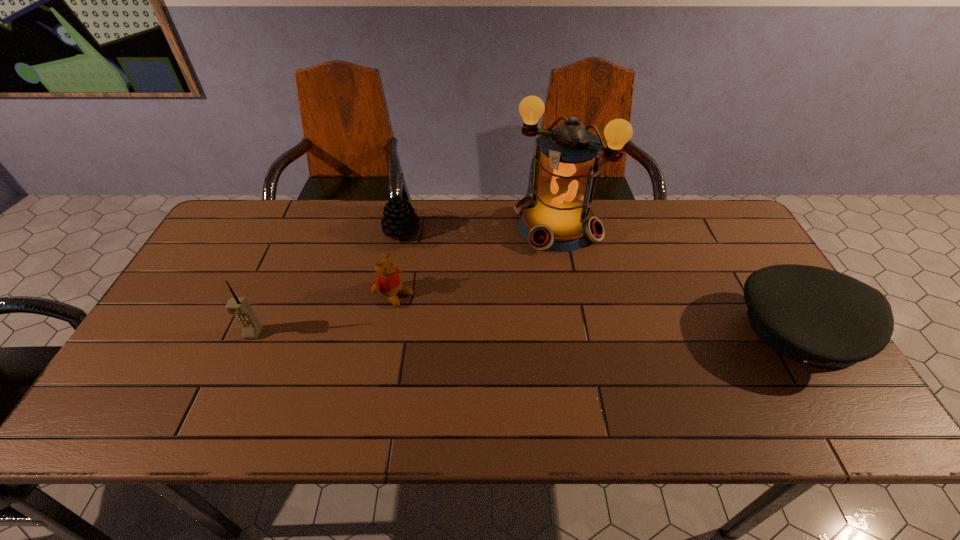
At what (x,y) coordinates should I click in order to perform the action: click on free space between the second object from right to left and the teddy bear. Please return your answer as a coordinate pair (x, y). Looking at the image, I should click on (476, 260).

The image size is (960, 540). I want to click on unoccupied area between the pinecone and the rightmost object, so click(598, 282).

This screenshot has height=540, width=960. I want to click on unoccupied area between the teddy bear and the rightmost object, so click(x=595, y=313).

At what (x,y) coordinates should I click in order to perform the action: click on vacant area that lies between the beret and the pinecone. Please return your answer as a coordinate pair (x, y). Looking at the image, I should click on (598, 282).

This screenshot has height=540, width=960. Find the location of `object that is the third closest one to the leftmost object`. object that is the third closest one to the leftmost object is located at coordinates click(557, 217).

Locate which object ranks fourth in proximity to the rightmost object. Please provide its 2D coordinates. Your answer should be formatted as a tuple, i.e. [(x, y)], where the tuple contains the x and y coordinates of a point satisfying the conditions above.

[(239, 306)]

Image resolution: width=960 pixels, height=540 pixels. I want to click on free space that satisfies the following two spatial constraints: 1. on the front side of the pinecone; 2. on the front-facing side of the rightmost object, so click(382, 333).